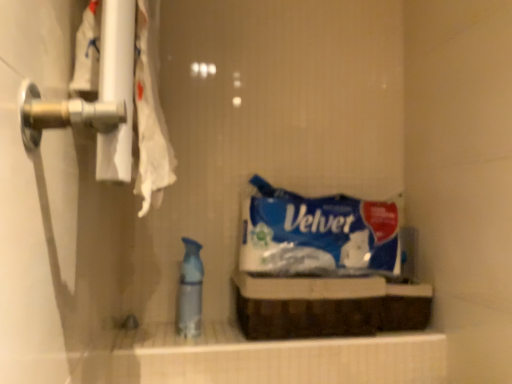
Locate an element on the screen. Image resolution: width=512 pixels, height=384 pixels. free space in front of translucent plastic spray bottle at center is located at coordinates (181, 345).